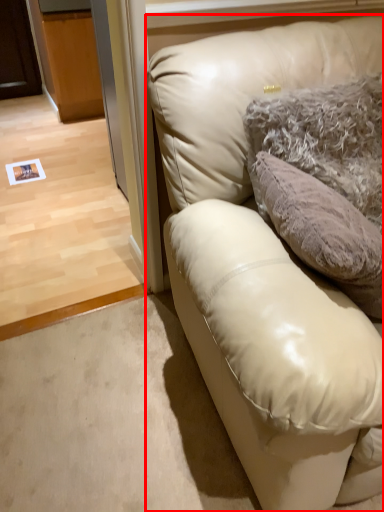
Question: From the image's perspective, where is studio couch (annotated by the red box) located relative to pillow?

Choices:
 (A) below
 (B) above

Answer: (A)